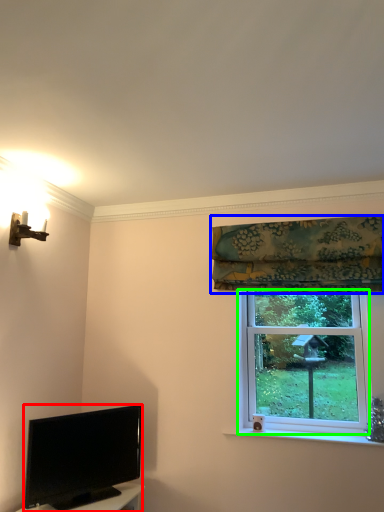
Question: Which is nearer to the television (highlighted by a red box)? curtain (highlighted by a blue box) or window screen (highlighted by a green box).

Choices:
 (A) curtain
 (B) window screen

Answer: (B)